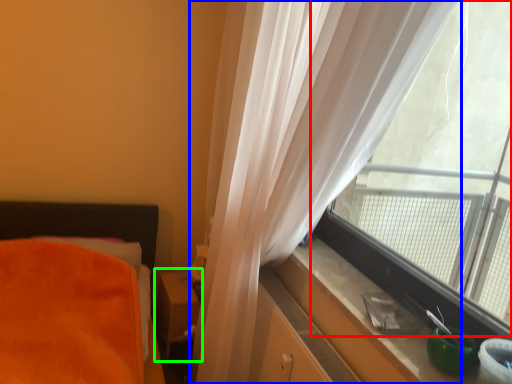
Question: Which object is the closest to the window (highlighted by a red box)? Choose among these: curtain (highlighted by a blue box) or table (highlighted by a green box).

Choices:
 (A) curtain
 (B) table

Answer: (A)